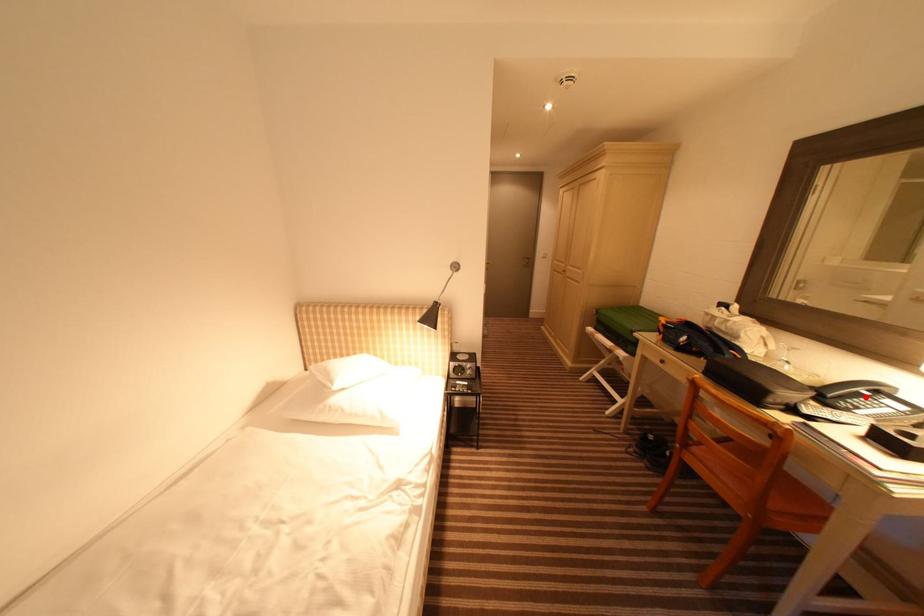
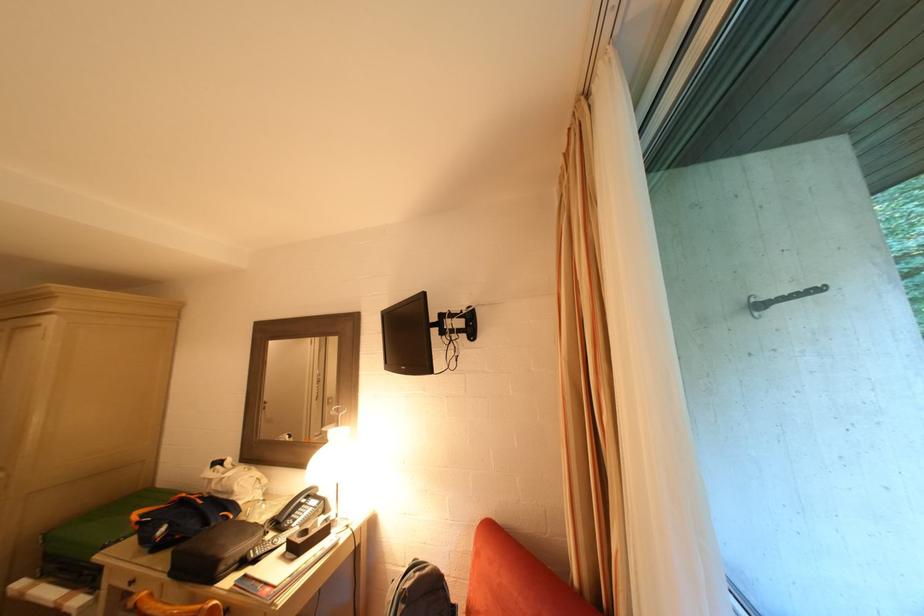
The point at the highlighted location is marked in the first image. Where is the corresponding point in the second image?

(306, 508)